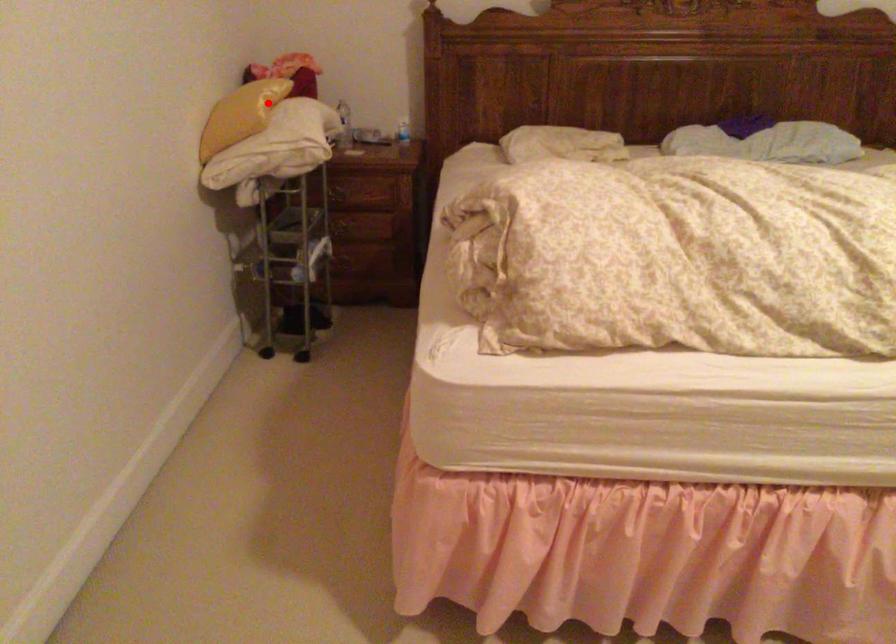
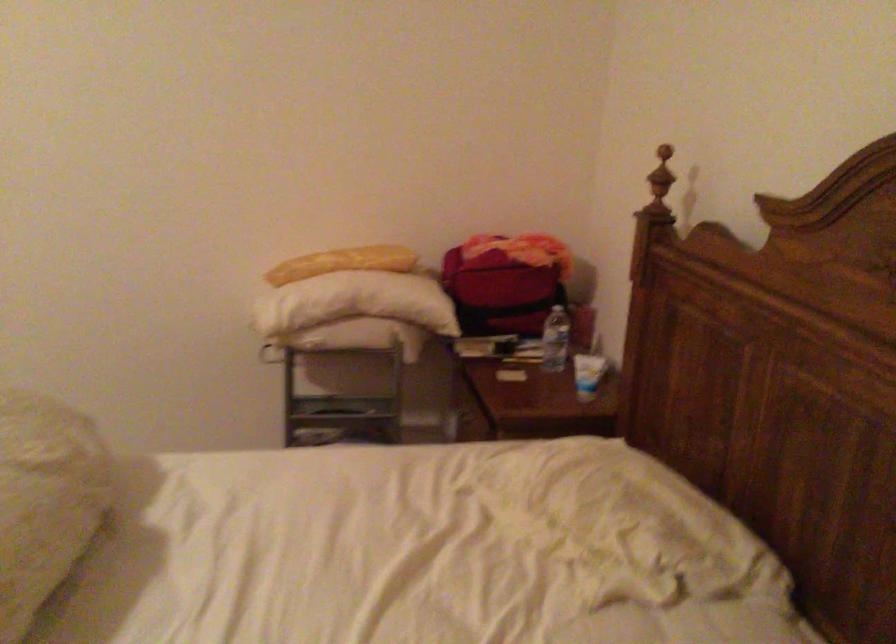
Locate, in the second image, the point that corresponds to the highlighted location in the first image.

(342, 263)